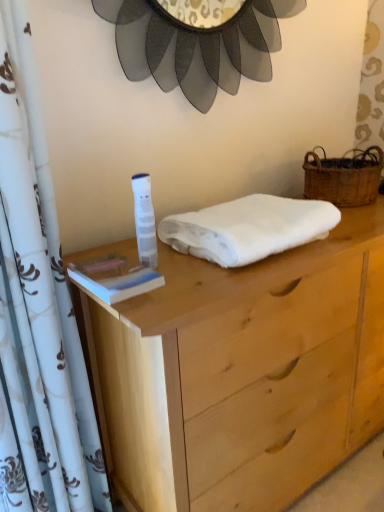
Question: In the image, is brown woven picnic basket at right positioned in front of or behind white floral fabric curtain at left?

Choices:
 (A) behind
 (B) front

Answer: (A)

Question: Is brown woven picnic basket at right to the left or to the right of white floral fabric curtain at left in the image?

Choices:
 (A) left
 (B) right

Answer: (B)

Question: Which of these objects is positioned closest to the white floral fabric curtain at left?

Choices:
 (A) white plastic tube at center
 (B) brown woven picnic basket at right
 (C) white soft towel at center
 (D) natural wood chest of drawers at center

Answer: (A)

Question: Based on their relative distances, which object is nearer to the brown woven picnic basket at right?

Choices:
 (A) white soft towel at center
 (B) natural wood chest of drawers at center
 (C) white plastic tube at center
 (D) white floral fabric curtain at left

Answer: (A)